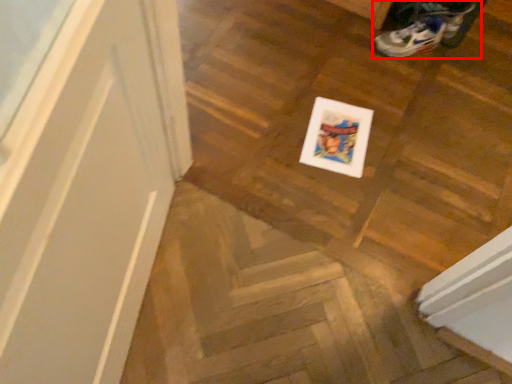
Question: Observing the image, what is the correct spatial positioning of footwear (annotated by the red box) in reference to stairwell?

Choices:
 (A) left
 (B) right

Answer: (B)